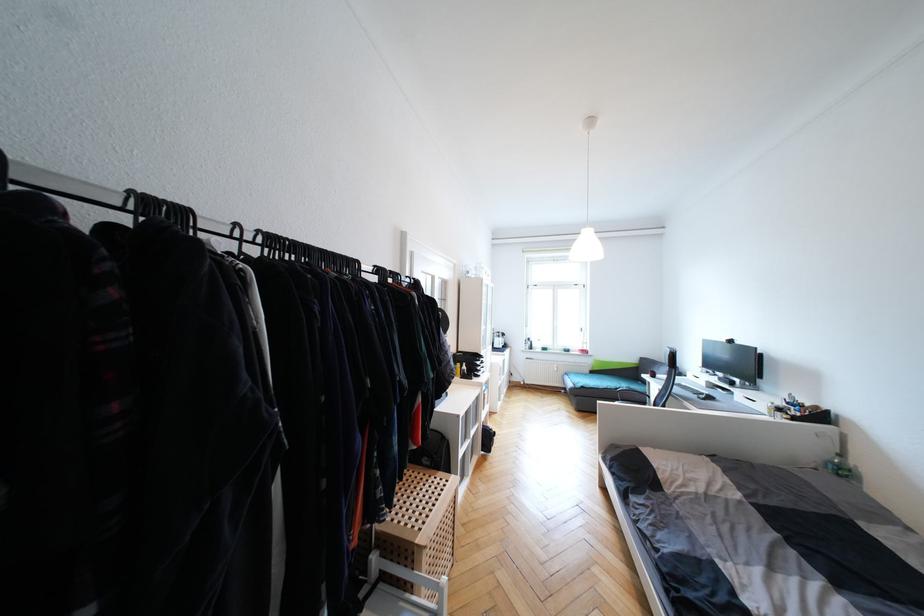
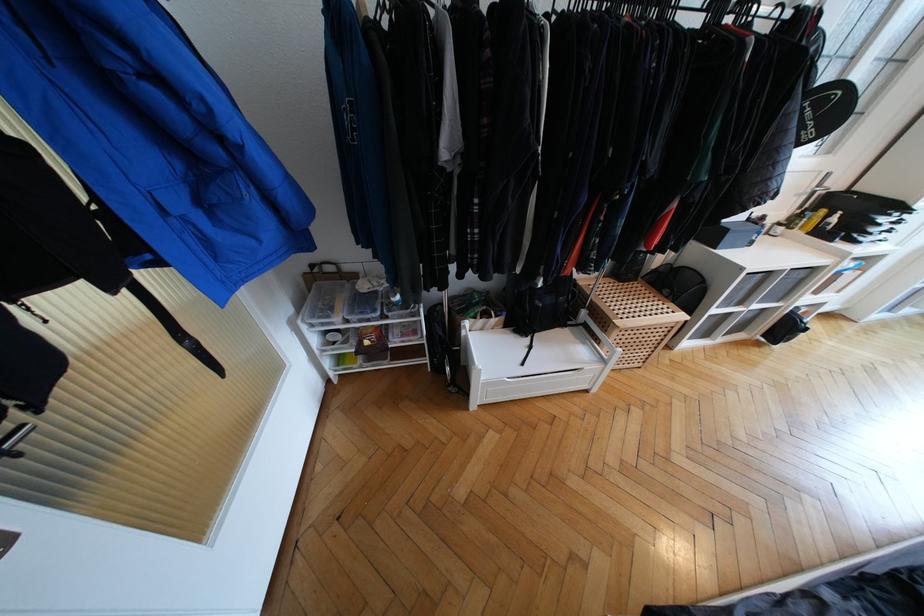
In the second image, find the point that corresponds to (456,480) in the first image.

(685, 317)